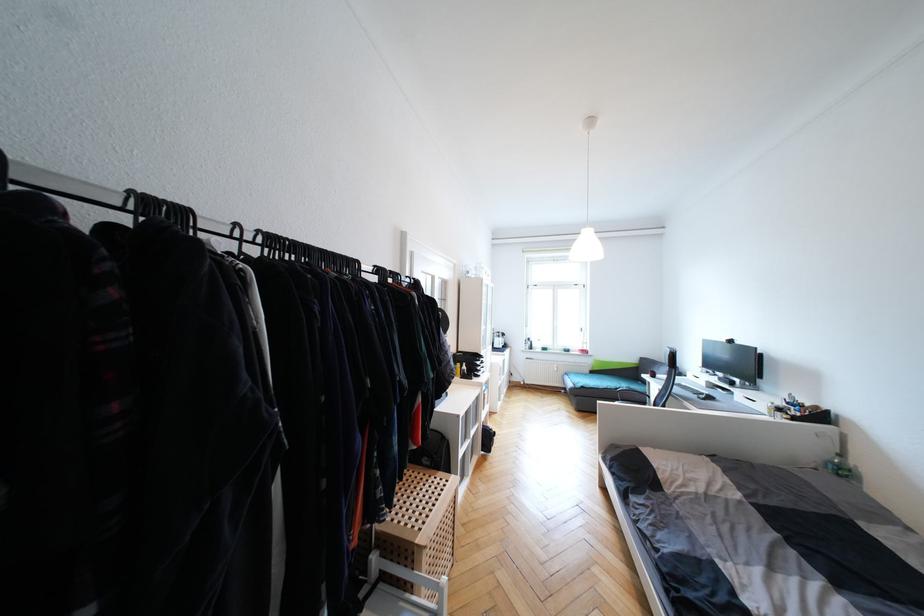
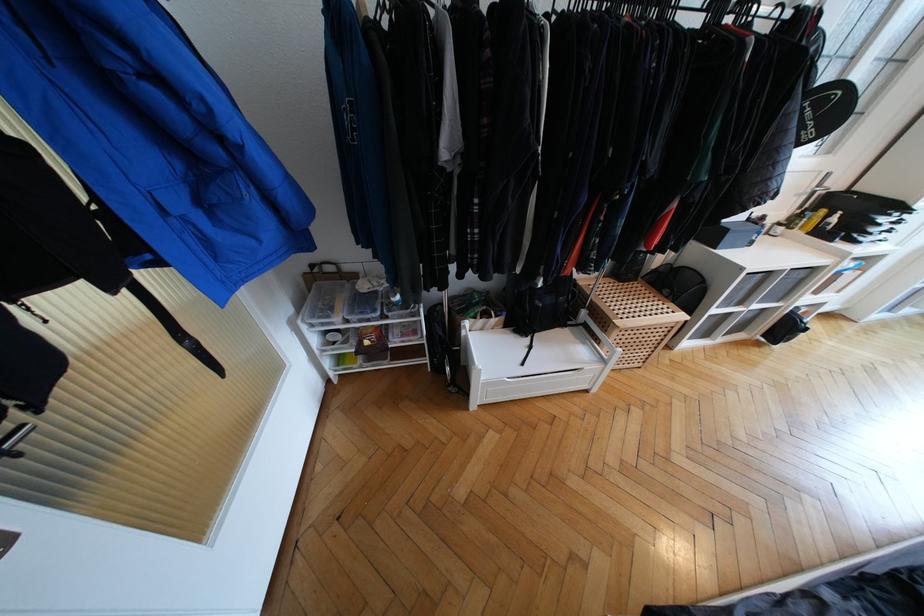
In the second image, find the point that corresponds to (456,480) in the first image.

(685, 317)